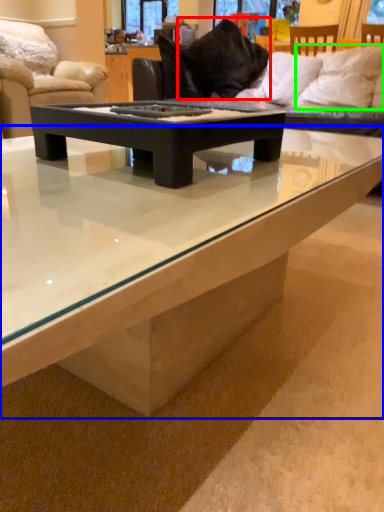
Question: Considering the real-world distances, which object is farthest from pillow (highlighted by a red box)? coffee table (highlighted by a blue box) or pillow (highlighted by a green box)?

Choices:
 (A) coffee table
 (B) pillow

Answer: (A)